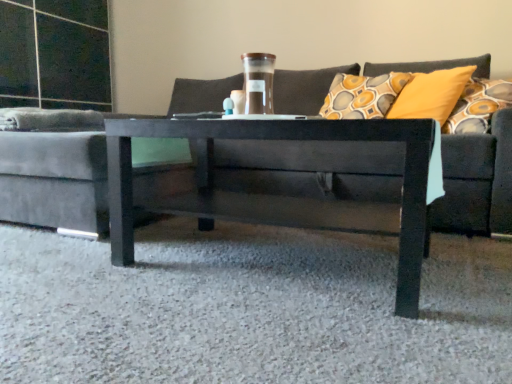
What do you see at coordinates (258, 82) in the screenshot? I see `translucent glass jar at center` at bounding box center [258, 82].

In order to click on translucent glass jar at center in this screenshot , I will do `click(258, 82)`.

This screenshot has height=384, width=512. Describe the element at coordinates (279, 139) in the screenshot. I see `glossy black coffee table at center` at that location.

This screenshot has height=384, width=512. In order to click on dark gray fabric couch at center in this screenshot , I will do `click(277, 181)`.

Is the depth of translucent glass jar at center less than that of glossy black coffee table at center?

No, translucent glass jar at center is further to the viewer.

Is translucent glass jar at center taller or shorter than glossy black coffee table at center?

Considering their sizes, translucent glass jar at center has less height than glossy black coffee table at center.

Is translucent glass jar at center facing towards glossy black coffee table at center?

No, translucent glass jar at center does not turn towards glossy black coffee table at center.

Is translucent glass jar at center surrounding glossy black coffee table at center?

Actually, glossy black coffee table at center is outside translucent glass jar at center.

Can you confirm if glossy black coffee table at center is smaller than dark gray fabric couch at center?

Correct, glossy black coffee table at center occupies less space than dark gray fabric couch at center.

Consider the image. Considering the relative sizes of glossy black coffee table at center and dark gray fabric couch at center in the image provided, is glossy black coffee table at center wider than dark gray fabric couch at center?

No, glossy black coffee table at center is not wider than dark gray fabric couch at center.

Considering the positions of objects glossy black coffee table at center and dark gray fabric couch at center in the image provided, who is more to the right, glossy black coffee table at center or dark gray fabric couch at center?

Positioned to the right is glossy black coffee table at center.

From the image's perspective, is glossy black coffee table at center over dark gray fabric couch at center?

Incorrect, from the image's perspective, glossy black coffee table at center is lower than dark gray fabric couch at center.

Considering the sizes of glossy black coffee table at center and translucent glass jar at center in the image, is glossy black coffee table at center wider or thinner than translucent glass jar at center?

Considering their sizes, glossy black coffee table at center looks broader than translucent glass jar at center.

In the scene shown: Is glossy black coffee table at center oriented away from translucent glass jar at center?

No, glossy black coffee table at center's orientation is not away from translucent glass jar at center.

Is glossy black coffee table at center situated inside translucent glass jar at center or outside?

glossy black coffee table at center exists outside the volume of translucent glass jar at center.

Considering the relative sizes of glossy black coffee table at center and translucent glass jar at center in the image provided, is glossy black coffee table at center taller than translucent glass jar at center?

Correct, glossy black coffee table at center is much taller as translucent glass jar at center.

Is there a large distance between dark gray fabric couch at center and translucent glass jar at center?

They are positioned close to each other.

How many degrees apart are the facing directions of dark gray fabric couch at center and translucent glass jar at center?

They differ by 2.36 degrees in their facing directions.

Is dark gray fabric couch at center turned away from translucent glass jar at center?

No, dark gray fabric couch at center's orientation is not away from translucent glass jar at center.

Is dark gray fabric couch at center spatially inside translucent glass jar at center, or outside of it?

dark gray fabric couch at center is located beyond the bounds of translucent glass jar at center.

Does translucent glass jar at center appear on the right side of dark gray fabric couch at center?

No.

Can you tell me how much translucent glass jar at center and dark gray fabric couch at center differ in facing direction?

2.36 degrees separate the facing orientations of translucent glass jar at center and dark gray fabric couch at center.

At what (x,y) coordinates should I click in order to perform the action: click on studio couch in front of the translucent glass jar at center. Please return your answer as a coordinate pair (x, y). Image resolution: width=512 pixels, height=384 pixels. Looking at the image, I should click on coord(277,181).

I want to click on studio couch located above the glossy black coffee table at center (from the image's perspective), so click(x=277, y=181).

From the image's perspective, which object appears higher, dark gray fabric couch at center or glossy black coffee table at center?

dark gray fabric couch at center appears higher in the image.

Considering the sizes of objects dark gray fabric couch at center and glossy black coffee table at center in the image provided, who is thinner, dark gray fabric couch at center or glossy black coffee table at center?

glossy black coffee table at center.

Is dark gray fabric couch at center closer to the viewer compared to glossy black coffee table at center?

Yes.

At what (x,y) coordinates should I click in order to perform the action: click on glass vase positioned vertically above the glossy black coffee table at center (from a real-world perspective). Please return your answer as a coordinate pair (x, y). Image resolution: width=512 pixels, height=384 pixels. Looking at the image, I should click on (258, 82).

This screenshot has height=384, width=512. I want to click on coffee table below the dark gray fabric couch at center (from a real-world perspective), so click(279, 139).

Estimate the real-world distances between objects in this image. Which object is closer to dark gray fabric couch at center, translucent glass jar at center or glossy black coffee table at center?

Among the two, glossy black coffee table at center is located nearer to dark gray fabric couch at center.

Which object lies nearer to the anchor point glossy black coffee table at center, dark gray fabric couch at center or translucent glass jar at center?

Among the two, translucent glass jar at center is located nearer to glossy black coffee table at center.

From the image, which object appears to be farther from translucent glass jar at center, dark gray fabric couch at center or glossy black coffee table at center?

The object further to translucent glass jar at center is dark gray fabric couch at center.

When comparing their distances from glossy black coffee table at center, does translucent glass jar at center or dark gray fabric couch at center seem closer?

translucent glass jar at center is closer to glossy black coffee table at center.

Which object lies nearer to the anchor point translucent glass jar at center, glossy black coffee table at center or dark gray fabric couch at center?

glossy black coffee table at center.

Based on their spatial positions, is glossy black coffee table at center or translucent glass jar at center further from dark gray fabric couch at center?

translucent glass jar at center is positioned further to the anchor dark gray fabric couch at center.

You are a GUI agent. You are given a task and a screenshot of the screen. Output one action in this format:
    pyautogui.click(x=<x>, y=<y>)
    Task: Click on the coffee table positioned between dark gray fabric couch at center and translucent glass jar at center from near to far
    The height and width of the screenshot is (384, 512).
    Given the screenshot: What is the action you would take?
    pyautogui.click(x=279, y=139)